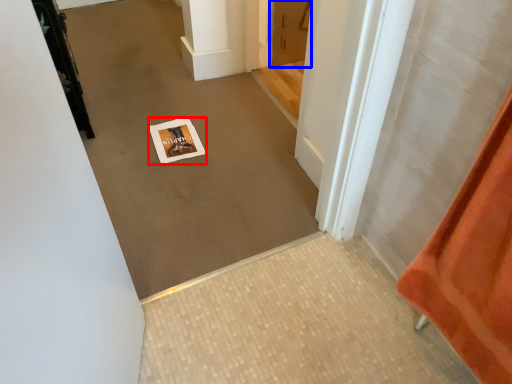
Question: Which object is closer to the camera taking this photo, postcard (highlighted by a red box) or door (highlighted by a blue box)?

Choices:
 (A) postcard
 (B) door

Answer: (A)